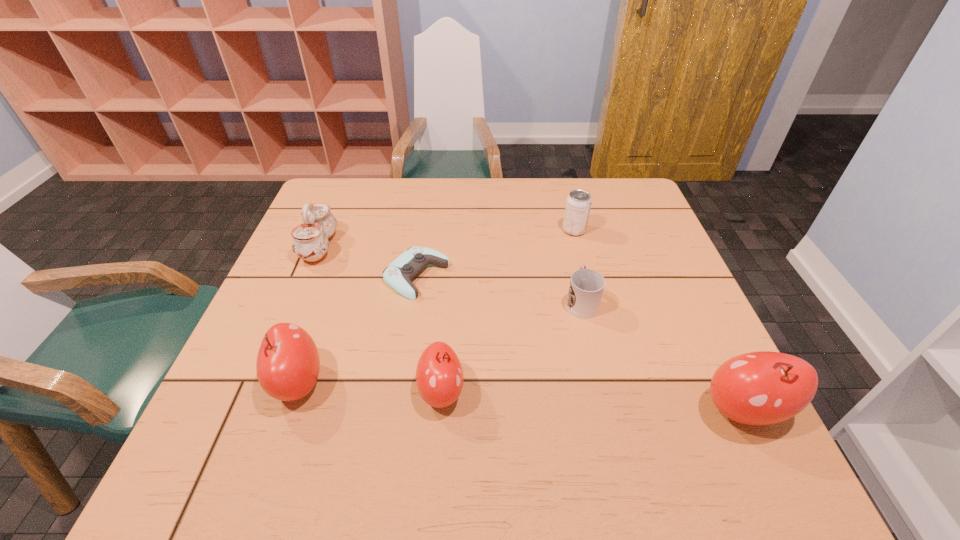
Find the location of `vacant space that is in between the chinaware and the soda can`. vacant space that is in between the chinaware and the soda can is located at coordinates (446, 239).

What are the coordinates of `vacant space that is in between the shortest object and the chinaware` in the screenshot? It's located at click(368, 261).

This screenshot has width=960, height=540. What are the coordinates of `vacant area that lies between the sixth tallest object and the soda can` in the screenshot? It's located at (578, 266).

Locate an element on the screen. This screenshot has height=540, width=960. free space between the second shortest apple and the rightmost apple is located at coordinates (520, 397).

Locate an element on the screen. The image size is (960, 540). free spot between the soda can and the chinaware is located at coordinates (446, 239).

The image size is (960, 540). Identify the location of vacant point located between the second apple from right to left and the soda can. (508, 311).

Locate an element on the screen. The width and height of the screenshot is (960, 540). vacant point located between the soda can and the sixth tallest object is located at coordinates (578, 266).

Find the location of `free space between the soda can and the sixth tallest object`. free space between the soda can and the sixth tallest object is located at coordinates (578, 266).

Locate which object is the fourth closest to the chinaware. Please provide its 2D coordinates. Your answer should be formatted as a tuple, i.e. [(x, y)], where the tuple contains the x and y coordinates of a point satisfying the conditions above.

[(586, 287)]

Choose which object is the fourth nearest neighbor to the soda can. Please provide its 2D coordinates. Your answer should be formatted as a tuple, i.e. [(x, y)], where the tuple contains the x and y coordinates of a point satisfying the conditions above.

[(439, 375)]